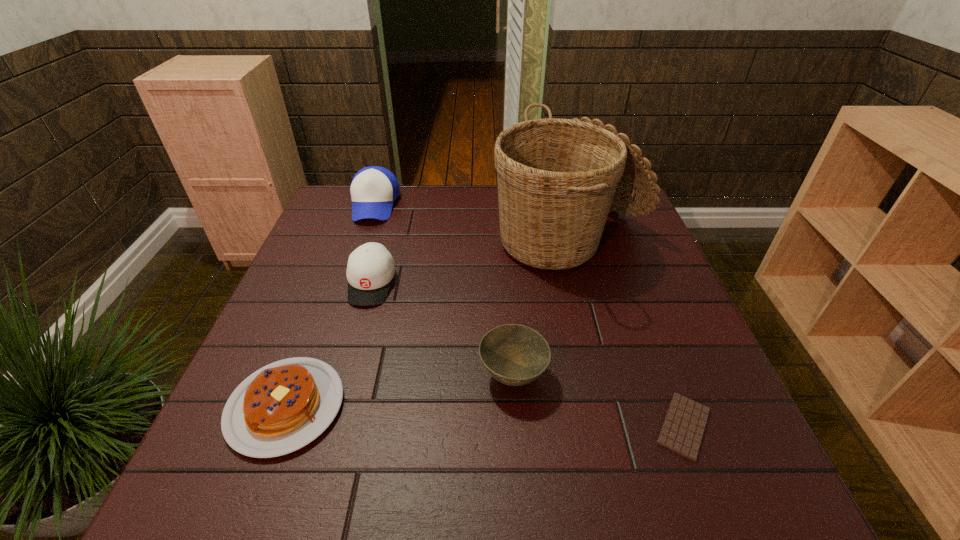
You are a GUI agent. You are given a task and a screenshot of the screen. Output one action in this format:
    pyautogui.click(x=<x>, y=<y>)
    Task: Click on the free point between the bowl and the basket
    
    Given the screenshot: What is the action you would take?
    pyautogui.click(x=541, y=308)

Image resolution: width=960 pixels, height=540 pixels. I want to click on vacant area that lies between the fifth tallest object and the farther baseball cap, so click(330, 306).

The width and height of the screenshot is (960, 540). Find the location of `unoccupied position between the fifth tallest object and the tallest object`. unoccupied position between the fifth tallest object and the tallest object is located at coordinates (428, 322).

The width and height of the screenshot is (960, 540). Identify the location of free area in between the bowl and the shortest object. (598, 401).

Find the location of a particular element. Image resolution: width=960 pixels, height=540 pixels. object that is the second closest to the nearer baseball cap is located at coordinates (373, 190).

Find the location of `the fourth closest object to the nearer baseball cap`. the fourth closest object to the nearer baseball cap is located at coordinates 557,178.

At what (x,y) coordinates should I click in order to perform the action: click on free region that satisfies the following two spatial constraints: 1. on the front-facing side of the nearer baseball cap; 2. on the right side of the bowl. Please return your answer as a coordinate pair (x, y). This screenshot has width=960, height=540. Looking at the image, I should click on (346, 376).

You are a GUI agent. You are given a task and a screenshot of the screen. Output one action in this format:
    pyautogui.click(x=<x>, y=<y>)
    Task: Click on the free space in the image that satisfies the following two spatial constraints: 1. on the front-facing side of the bowl; 2. on the left side of the nearer baseball cap
    
    Given the screenshot: What is the action you would take?
    pyautogui.click(x=346, y=376)

At what (x,y) coordinates should I click in order to perform the action: click on vacant area that satisfies the following two spatial constraints: 1. on the back side of the pancake; 2. on the right side of the basket. Please return your answer as a coordinate pair (x, y). Looking at the image, I should click on (349, 239).

Where is `free point that satisfies the following two spatial constraints: 1. on the front side of the fifth tallest object; 2. on the left side of the shortest object`? This screenshot has width=960, height=540. free point that satisfies the following two spatial constraints: 1. on the front side of the fifth tallest object; 2. on the left side of the shortest object is located at coordinates [x=278, y=426].